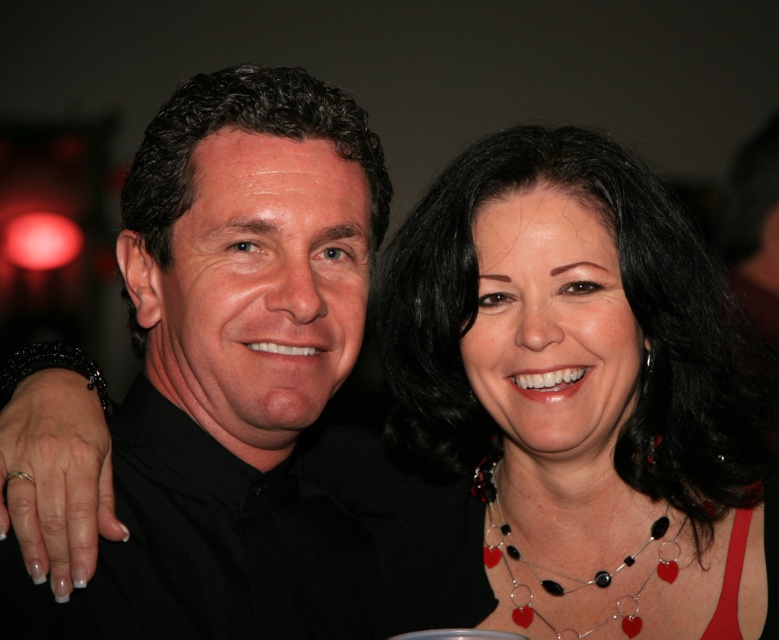
Does black glossy necklace at upper center have a smaller size compared to black glass heart-shaped pendants at center?

Incorrect, black glossy necklace at upper center is not smaller in size than black glass heart-shaped pendants at center.

Who is positioned more to the left, black glossy necklace at upper center or black glass heart-shaped pendants at center?

black glass heart-shaped pendants at center is more to the left.

Is point (533, 298) positioned after point (640, 618)?

That is False.

Find the location of a particular element. black glossy necklace at upper center is located at coordinates (580, 392).

Which is more to the left, black matte shirt at center or black glass heart-shaped pendants at center?

Positioned to the left is black matte shirt at center.

At what (x,y) coordinates should I click in order to perform the action: click on black matte shirt at center. Please return your answer as a coordinate pair (x, y). The height and width of the screenshot is (640, 779). Looking at the image, I should click on (231, 369).

Identify the location of black glossy necklace at upper center. (580, 392).